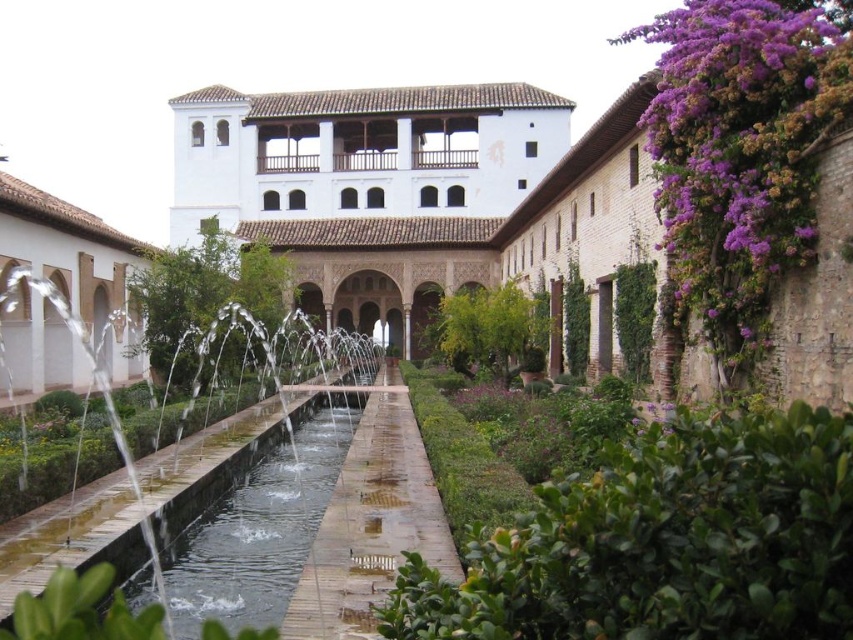
What do you see at coordinates (740, 147) in the screenshot?
I see `purple textured wall at upper right` at bounding box center [740, 147].

Is point (701, 228) less distant than point (259, 440)?

Yes, it is.

In order to click on purple textured wall at upper right in this screenshot , I will do `click(740, 147)`.

Looking at this image, which of these two, green leafy bush at lower right or clear glass water at center, stands shorter?

green leafy bush at lower right is shorter.

Find the location of a particular element. green leafy bush at lower right is located at coordinates tap(664, 541).

Which is below, green leafy bush at lower right or purple textured wall at upper right?

green leafy bush at lower right is lower down.

Can you confirm if green leafy bush at lower right is positioned above purple textured wall at upper right?

No, green leafy bush at lower right is not above purple textured wall at upper right.

Is point (477, 602) less distant than point (701, 157)?

Yes, point (477, 602) is closer to viewer.

This screenshot has width=853, height=640. I want to click on green leafy bush at lower right, so click(x=664, y=541).